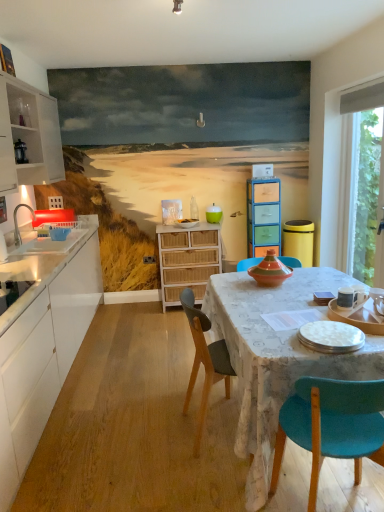
This screenshot has width=384, height=512. What are the coordinates of `blank space situated above textured fabric tablecloth at center (from a real-world perspective)` in the screenshot? It's located at (315, 296).